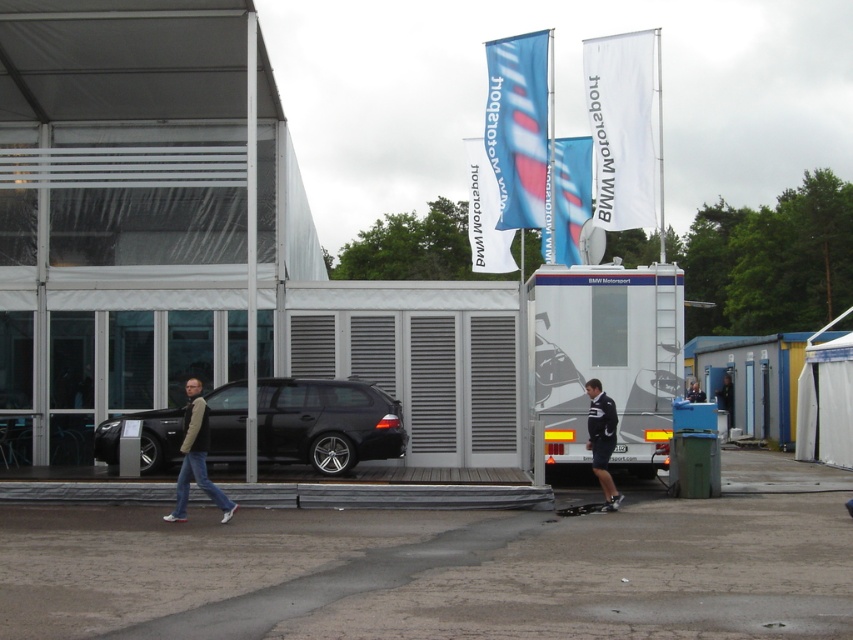
You are at the BMW Motorsport event and see a point marked at coordinates (602, 440). According to the image, what is this point located on?

The point at (602, 440) is located on the dark blue uniform at center.

You are standing at the entrance of the BMW Motorsport event and see the dark gray jeans at lower left and the black rubber skateboard at lower center. Which object is closer to you?

The dark gray jeans at lower left is closer to you because it is in front of the black rubber skateboard at lower center.

You are a photographer at the event and need to capture both the dark blue uniform at center and the black rubber skateboard at lower center in a single frame. Which object should you focus on first to ensure both are in the shot?

The dark blue uniform at center is larger than the black rubber skateboard at lower center, so focusing on the dark blue uniform at center first will help ensure both objects are captured in the frame.